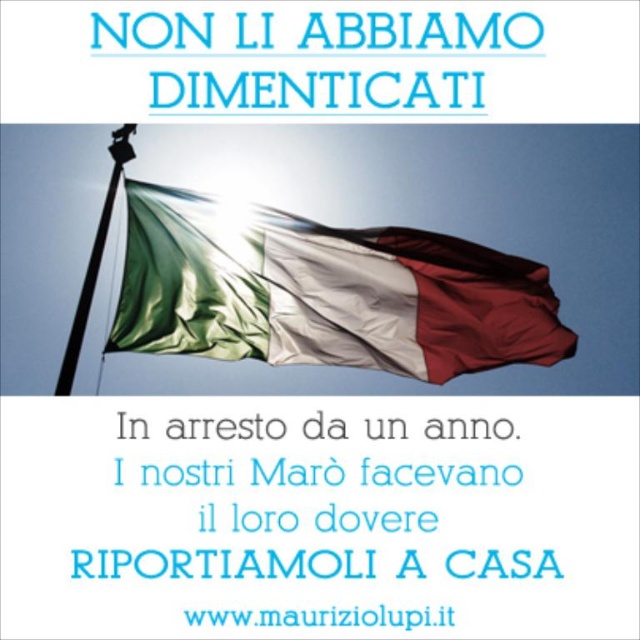
Question: Is silky fabric flag at center below black metal flag pole at upper left?

Choices:
 (A) yes
 (B) no

Answer: (A)

Question: Among these objects, which one is nearest to the camera?

Choices:
 (A) silky fabric flag at center
 (B) black metal flag pole at upper left

Answer: (B)

Question: Does silky fabric flag at center come behind black metal flag pole at upper left?

Choices:
 (A) yes
 (B) no

Answer: (A)

Question: Is silky fabric flag at center in front of black metal flag pole at upper left?

Choices:
 (A) yes
 (B) no

Answer: (B)

Question: Which point appears closest to the camera in this image?

Choices:
 (A) (80, 346)
 (B) (440, 236)

Answer: (A)